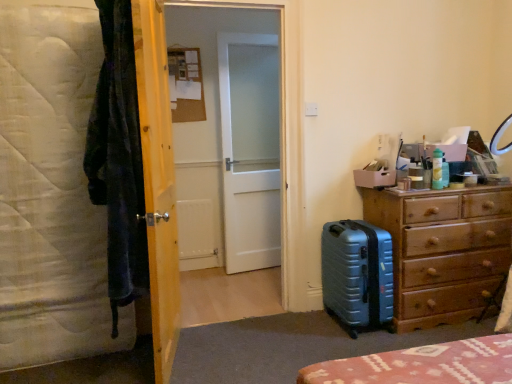
What is the approximate width of white cardboard box at right?

10.08 inches.

Find the location of `white cardboard box at right`. white cardboard box at right is located at coordinates (375, 178).

Where is `metallic blue suitcase at lower right`? This screenshot has width=512, height=384. metallic blue suitcase at lower right is located at coordinates (357, 274).

Image resolution: width=512 pixels, height=384 pixels. I want to click on white matte screen door at center, the second screen door viewed from the front, so click(250, 151).

Measure the distance between green plastic bottle at upper right and camera.

2.57 meters.

I want to click on green plastic bottle at upper right, so click(x=437, y=169).

Describe the element at coordinates (158, 181) in the screenshot. I see `wooden door at center` at that location.

Find the location of a particular element. This screenshot has height=384, width=512. matte plastic cup at right is located at coordinates (416, 178).

At what (x,y) coordinates should I click in order to perform the action: click on wooden dresser at right. Please return your answer as a coordinate pair (x, y). This screenshot has width=512, height=384. Looking at the image, I should click on (443, 250).

How different are the orientations of white matte screen door at center, which is the first screen door from back to front, and white cardboard box at right in degrees?

The facing directions of white matte screen door at center, which is the first screen door from back to front, and white cardboard box at right are 9.07 degrees apart.

Is white matte screen door at center, the second screen door viewed from the front, outside of white cardboard box at right?

That's correct, white matte screen door at center, the second screen door viewed from the front, is outside of white cardboard box at right.

Is point (264, 210) closer to camera compared to point (386, 177)?

No, (264, 210) is behind (386, 177).

Can you confirm if white matte screen door at center, the second screen door viewed from the front, is smaller than white cardboard box at right?

Incorrect, white matte screen door at center, the second screen door viewed from the front, is not smaller in size than white cardboard box at right.

Which of these two, white matte screen door at center, the second screen door viewed from the front, or wooden dresser at right, is bigger?

wooden dresser at right is bigger.

From a real-world perspective, is white matte screen door at center, the second screen door viewed from the front, located higher than wooden dresser at right?

Yes, from a real-world perspective, white matte screen door at center, the second screen door viewed from the front, is over wooden dresser at right

Looking at this image, is white matte screen door at center, which is the first screen door from back to front, taller or shorter than wooden dresser at right?

Clearly, white matte screen door at center, which is the first screen door from back to front, is taller compared to wooden dresser at right.

Do you think white matte screen door at center, the second screen door viewed from the front, is within green plastic bottle at upper right, or outside of it?

white matte screen door at center, the second screen door viewed from the front, is not enclosed by green plastic bottle at upper right.

From their relative heights in the image, would you say white matte screen door at center, the second screen door viewed from the front, is taller or shorter than green plastic bottle at upper right?

Considering their sizes, white matte screen door at center, the second screen door viewed from the front, has more height than green plastic bottle at upper right.

Considering the sizes of white matte screen door at center, the second screen door viewed from the front, and green plastic bottle at upper right in the image, is white matte screen door at center, the second screen door viewed from the front, bigger or smaller than green plastic bottle at upper right?

In the image, white matte screen door at center, the second screen door viewed from the front, appears to be larger than green plastic bottle at upper right.

Can you tell me how much white matte screen door at center, the second screen door viewed from the front, and green plastic bottle at upper right differ in facing direction?

8.23 degrees.

Which point is more forward, (x=233, y=230) or (x=222, y=215)?

The point (x=233, y=230) is more forward.

Can you confirm if white matte screen door at center, the second screen door viewed from the front, is thinner than white frosted glass door at center, which appears as the 2th screen door when viewed from the back?

Yes.

What's the angular difference between white matte screen door at center, which is the first screen door from back to front, and white frosted glass door at center, marked as the 1th screen door in a front-to-back arrangement,'s facing directions?

8.41 degrees separate the facing orientations of white matte screen door at center, which is the first screen door from back to front, and white frosted glass door at center, marked as the 1th screen door in a front-to-back arrangement.

Which is behind, white matte screen door at center, the second screen door viewed from the front, or white frosted glass door at center, which appears as the 2th screen door when viewed from the back?

white matte screen door at center, the second screen door viewed from the front.

What are the coordinates of `the 1st screen door above when counting from the wooden dresser at right (from the image's perspective)` in the screenshot? It's located at (223, 178).

Can you confirm if wooden dresser at right is positioned to the left of white frosted glass door at center, marked as the 1th screen door in a front-to-back arrangement?

No.

Is point (392, 197) farther from viewer compared to point (234, 15)?

No, (392, 197) is in front of (234, 15).

Is metallic blue suitcase at lower right located outside wooden dresser at right?

Yes, metallic blue suitcase at lower right is outside of wooden dresser at right.

Does metallic blue suitcase at lower right have a smaller size compared to wooden dresser at right?

Correct, metallic blue suitcase at lower right occupies less space than wooden dresser at right.

From the image's perspective, is metallic blue suitcase at lower right under wooden dresser at right?

Correct, metallic blue suitcase at lower right appears lower than wooden dresser at right in the image.

Is metallic blue suitcase at lower right far from wooden dresser at right?

That's not correct — metallic blue suitcase at lower right is a little close to wooden dresser at right.

Can you confirm if white matte screen door at center, which is the first screen door from back to front, is positioned to the right of matte plastic cup at right?

Incorrect, white matte screen door at center, which is the first screen door from back to front, is not on the right side of matte plastic cup at right.

Is point (276, 187) closer to viewer compared to point (412, 180)?

That is False.

From the image's perspective, relative to matte plastic cup at right, is white matte screen door at center, which is the first screen door from back to front, above or below?

white matte screen door at center, which is the first screen door from back to front, is above matte plastic cup at right.

The height and width of the screenshot is (384, 512). What are the coordinates of `box below the white matte screen door at center, which is the first screen door from back to front (from the image's perspective)` in the screenshot? It's located at (375, 178).

Find the location of a particular element. Image resolution: width=512 pixels, height=384 pixels. cabinetry on the right of white matte screen door at center, the second screen door viewed from the front is located at coordinates (443, 250).

From the image, which object appears to be farther from white frosted glass door at center, marked as the 1th screen door in a front-to-back arrangement, metallic blue suitcase at lower right or white cardboard box at right?

white cardboard box at right is further to white frosted glass door at center, marked as the 1th screen door in a front-to-back arrangement.

Estimate the real-world distances between objects in this image. Which object is closer to wooden dresser at right, white cardboard box at right or white quilted mattress at left?

Based on the image, white cardboard box at right appears to be nearer to wooden dresser at right.

Based on the photo, estimate the real-world distances between objects in this image. Which object is further from white matte screen door at center, the second screen door viewed from the front, wooden door at center or wooden dresser at right?

Among the two, wooden dresser at right is located further to white matte screen door at center, the second screen door viewed from the front.

From the image, which object appears to be nearer to white matte screen door at center, which is the first screen door from back to front, wooden door at center or metallic blue suitcase at lower right?

Based on the image, metallic blue suitcase at lower right appears to be nearer to white matte screen door at center, which is the first screen door from back to front.

Estimate the real-world distances between objects in this image. Which object is further from matte plastic cup at right, wooden dresser at right or green plastic bottle at upper right?

wooden dresser at right is positioned further to the anchor matte plastic cup at right.

Estimate the real-world distances between objects in this image. Which object is closer to white cardboard box at right, metallic blue suitcase at lower right or white matte screen door at center, which is the first screen door from back to front?

Among the two, metallic blue suitcase at lower right is located nearer to white cardboard box at right.

Considering their positions, is wooden door at center positioned further to white quilted mattress at left than white matte screen door at center, the second screen door viewed from the front?

Among the two, white matte screen door at center, the second screen door viewed from the front, is located further to white quilted mattress at left.

Looking at this image, based on their spatial positions, is wooden dresser at right or white quilted mattress at left further from white cardboard box at right?

The object further to white cardboard box at right is white quilted mattress at left.

What are the coordinates of `screen door between wooden door at center and white matte screen door at center, which is the first screen door from back to front, along the z-axis` in the screenshot? It's located at (223, 178).

The image size is (512, 384). I want to click on screen door positioned between white quilted mattress at left and white matte screen door at center, the second screen door viewed from the front, from near to far, so click(223, 178).

Where is `box between green plastic bottle at upper right and metallic blue suitcase at lower right in the up-down direction`? This screenshot has width=512, height=384. box between green plastic bottle at upper right and metallic blue suitcase at lower right in the up-down direction is located at coordinates (375, 178).

I want to click on bottle located between white matte screen door at center, which is the first screen door from back to front, and wooden dresser at right in the left-right direction, so click(437, 169).